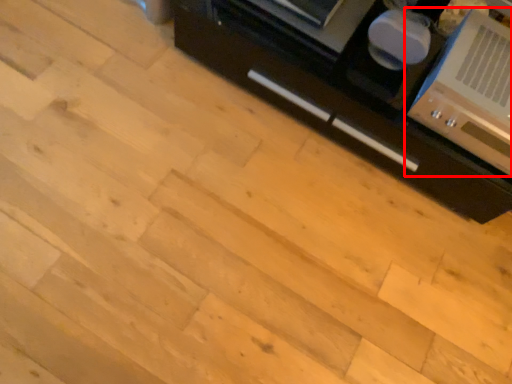
Question: From the image, what is the correct spatial relationship of home appliance (annotated by the red box) in relation to cabinetry?

Choices:
 (A) right
 (B) left

Answer: (A)